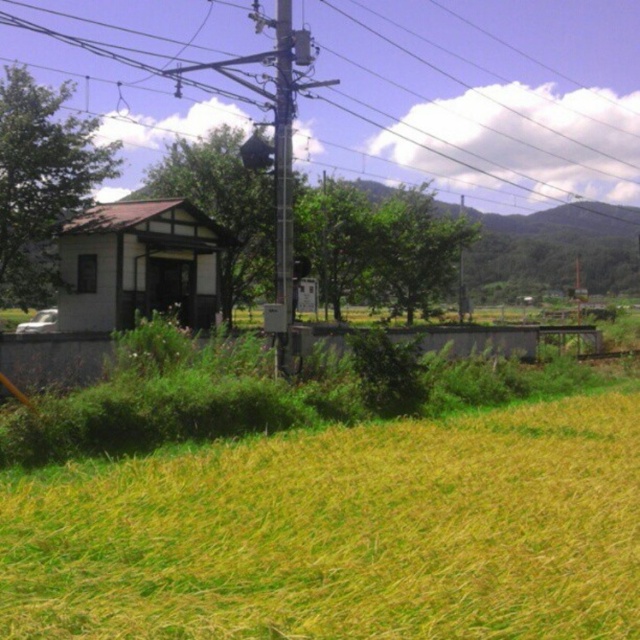
Question: Is metallic wire at upper center further to camera compared to metallic gray telegraph pole at center?

Choices:
 (A) no
 (B) yes

Answer: (B)

Question: Does yellow grass at lower right appear on the right side of metallic wire at upper center?

Choices:
 (A) yes
 (B) no

Answer: (A)

Question: Which is farther from the metallic wire at upper center?

Choices:
 (A) metallic gray telegraph pole at center
 (B) yellow grass at lower right

Answer: (B)

Question: Which is nearer to the yellow grass at lower right?

Choices:
 (A) metallic gray telegraph pole at center
 (B) metallic wire at upper center

Answer: (A)

Question: Can you confirm if metallic wire at upper center is positioned to the left of metallic gray telegraph pole at center?

Choices:
 (A) no
 (B) yes

Answer: (A)

Question: Which point is closer to the camera taking this photo?

Choices:
 (A) (280, 362)
 (B) (529, 582)

Answer: (B)